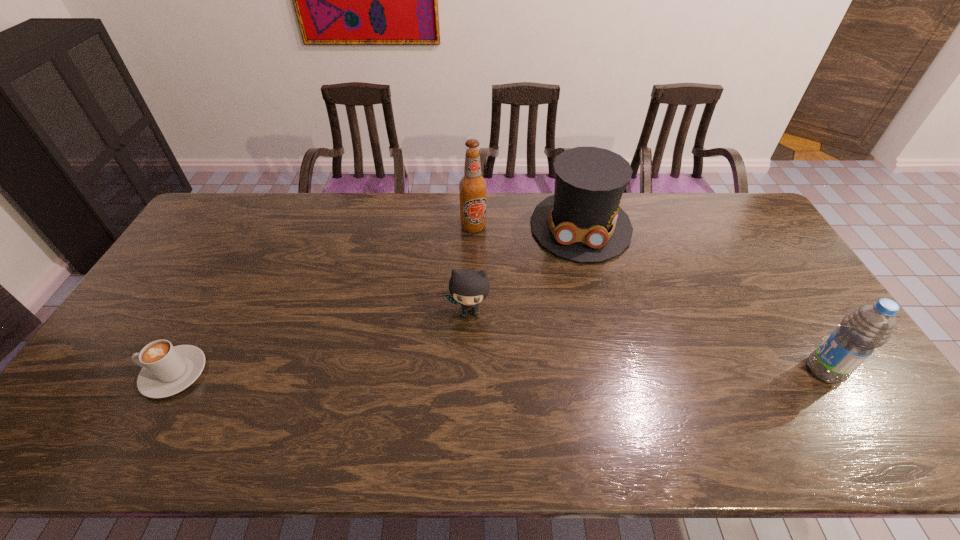
Locate an element on the screen. The width and height of the screenshot is (960, 540). empty location between the leftmost object and the third nearest object is located at coordinates [x=322, y=342].

At what (x,y) coordinates should I click in order to perform the action: click on object that ranks as the second closest to the fourth object from left to right. Please return your answer as a coordinate pair (x, y). This screenshot has height=540, width=960. Looking at the image, I should click on (468, 287).

Identify which object is the second nearest to the kitten. Please provide its 2D coordinates. Your answer should be formatted as a tuple, i.e. [(x, y)], where the tuple contains the x and y coordinates of a point satisfying the conditions above.

[(472, 186)]

This screenshot has width=960, height=540. Identify the location of vacant space that satisfies the following two spatial constraints: 1. on the back side of the kitten; 2. on the left side of the tallest object. (471, 227).

Find the location of a particular element. free point that satisfies the following two spatial constraints: 1. on the front side of the water bottle; 2. on the left side of the dress hat is located at coordinates (616, 370).

Where is `vacant space that satisfies the following two spatial constraints: 1. on the back side of the tallest object; 2. on the left side of the kitten`? Image resolution: width=960 pixels, height=540 pixels. vacant space that satisfies the following two spatial constraints: 1. on the back side of the tallest object; 2. on the left side of the kitten is located at coordinates (471, 227).

At what (x,y) coordinates should I click in order to perform the action: click on vacant space that satisfies the following two spatial constraints: 1. on the front side of the water bottle; 2. on the right side of the kitten. Please return your answer as a coordinate pair (x, y). Looking at the image, I should click on (468, 370).